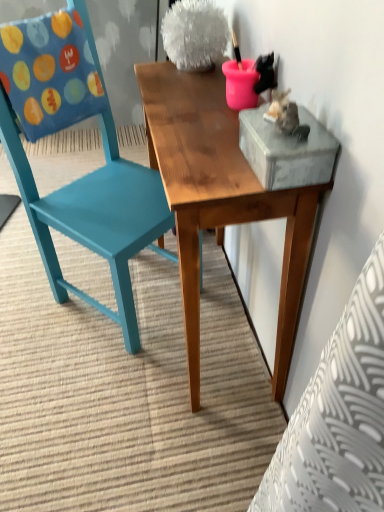
What are the coordinates of `vacant space situated above wooden table at center (from a real-world perspective)` in the screenshot? It's located at pyautogui.click(x=203, y=114).